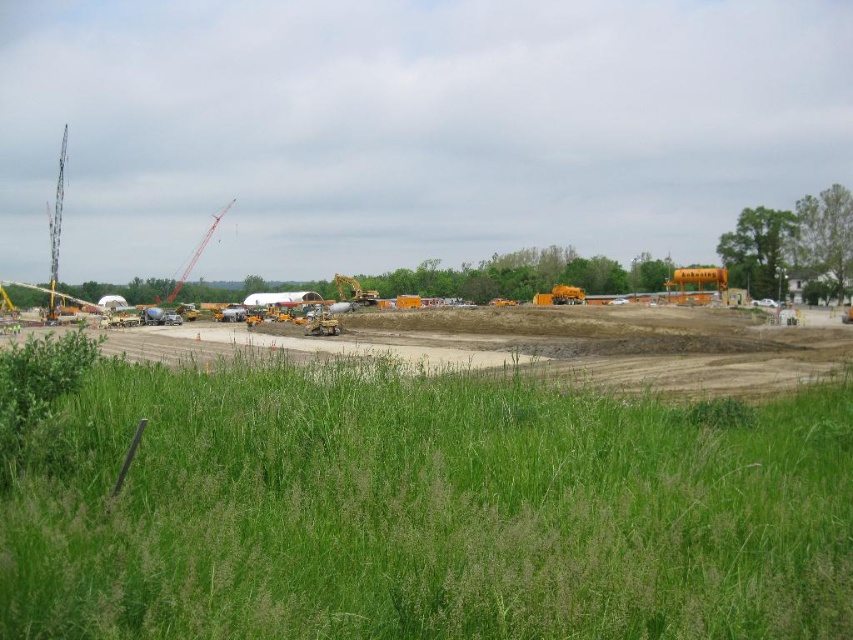
You are a construction worker standing at the center of the construction site. You need to locate the orange metallic crane at left. According to the coordinates provided, where should you look relative to your position?

The orange metallic crane at left is located at coordinates point (195, 253), which is to the left and slightly forward from your central position on the site.

Based on the photo, you are a construction worker who needs to move a heavy equipment from the yellow metallic excavator at center to the green grass at lower center. Can you do this without damaging the grass?

The green grass at lower center is smaller than the yellow metallic excavator at center, so it may not be able to support the weight of the excavator without getting damaged. It is recommended to avoid placing heavy equipment on the grass to prevent damage.